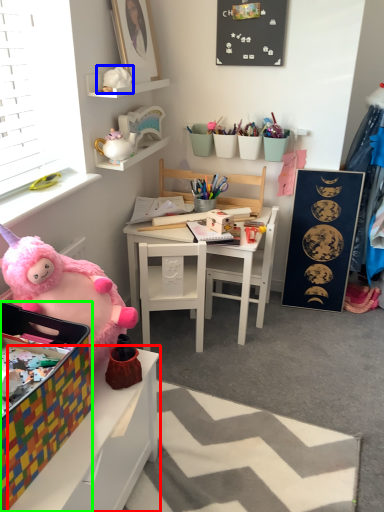
Question: Estimate the real-world distances between objects in this image. Which object is closer to table (highlighted by a red box), toy (highlighted by a blue box) or box (highlighted by a green box)?

Choices:
 (A) toy
 (B) box

Answer: (B)